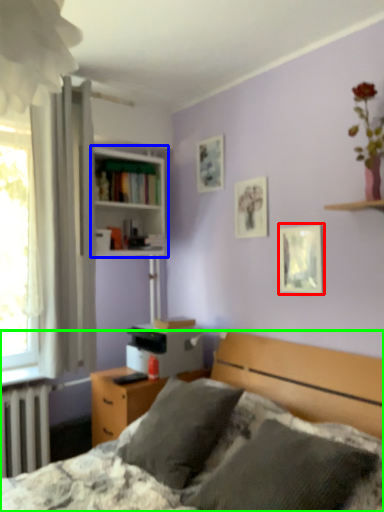
Question: Which is nearer to the picture frame (highlighted by a red box)? bookcase (highlighted by a blue box) or bed (highlighted by a green box).

Choices:
 (A) bookcase
 (B) bed

Answer: (B)